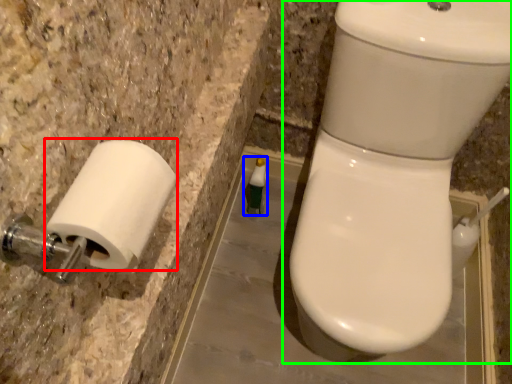
Question: Estimate the real-world distances between objects in this image. Which object is closer to toilet paper (highlighted by a red box), toiletry (highlighted by a blue box) or toilet (highlighted by a green box)?

Choices:
 (A) toiletry
 (B) toilet

Answer: (B)